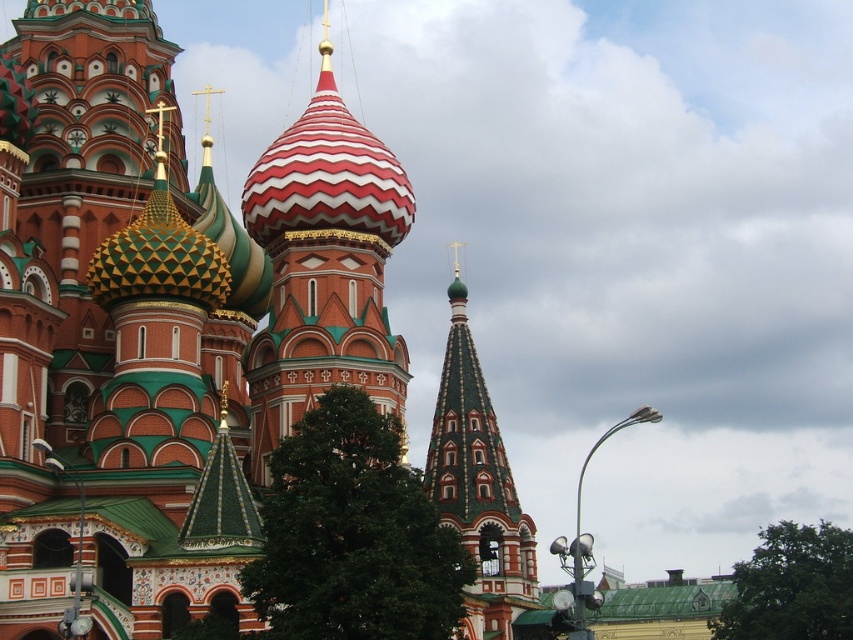
Between point (350, 115) and point (479, 403), which one is positioned behind?

Positioned behind is point (479, 403).

Which is behind, point (163, 477) or point (436, 420)?

Positioned behind is point (436, 420).

Locate an element on the screen. polychrome mosaic dome at center is located at coordinates pos(166,321).

Is point (379, 348) positioned after point (453, 381)?

That is False.

Between red and white striped dome at center and green mosaic dome at center, which one appears on the right side from the viewer's perspective?

green mosaic dome at center

Does point (363, 340) come farther from viewer compared to point (462, 342)?

No, (363, 340) is closer to viewer.

This screenshot has width=853, height=640. In order to click on red and white striped dome at center in this screenshot , I will do `click(323, 266)`.

Which of these two, polychrome mosaic dome at center or red and white striped dome at center, stands shorter?

Standing shorter between the two is red and white striped dome at center.

The image size is (853, 640). What do you see at coordinates (166, 321) in the screenshot?
I see `polychrome mosaic dome at center` at bounding box center [166, 321].

At what (x,y) coordinates should I click in order to perform the action: click on polychrome mosaic dome at center. Please return your answer as a coordinate pair (x, y). This screenshot has width=853, height=640. Looking at the image, I should click on (166, 321).